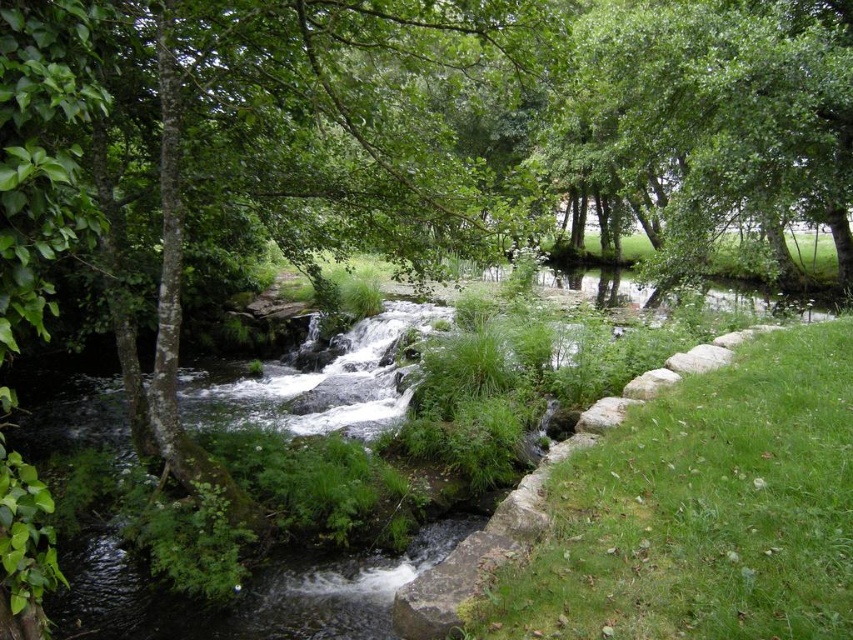
Is green grass at lower right smaller than green leafy tree at upper center?

Correct, green grass at lower right occupies less space than green leafy tree at upper center.

Between point (840, 632) and point (762, 140), which one is positioned in front?

Positioned in front is point (840, 632).

I want to click on green grass at lower right, so click(701, 509).